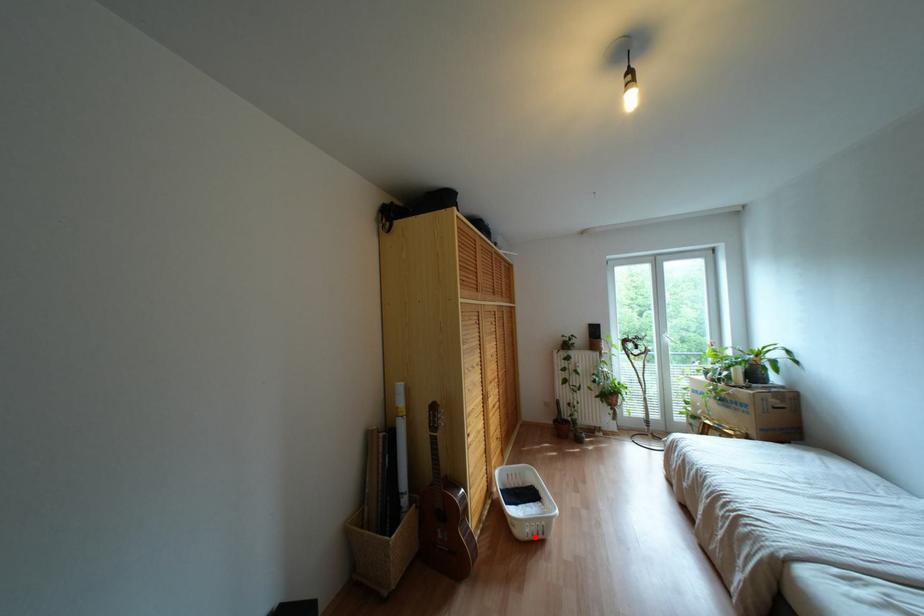
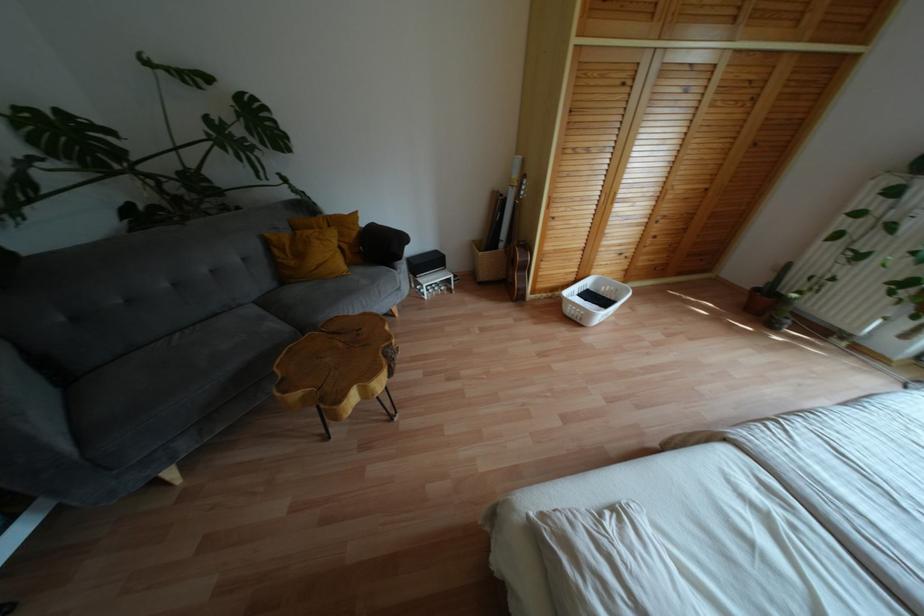
Question: I am providing you with two images of the same scene from different viewpoints. Given a red point in image1, look at the same physical point in image2. Is it:

Choices:
 (A) Closer to the viewpoint
 (B) Farther from the viewpoint

Answer: (A)